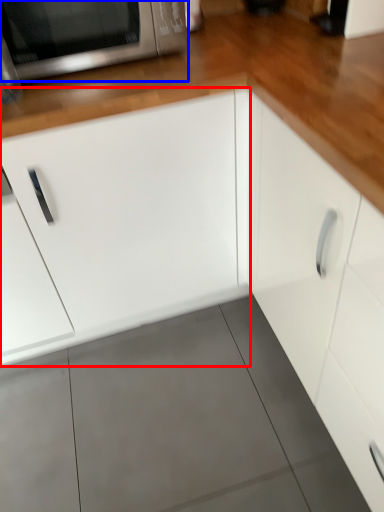
Question: Which point is further to the camera, cabinetry (highlighted by a red box) or microwave oven (highlighted by a blue box)?

Choices:
 (A) cabinetry
 (B) microwave oven

Answer: (B)